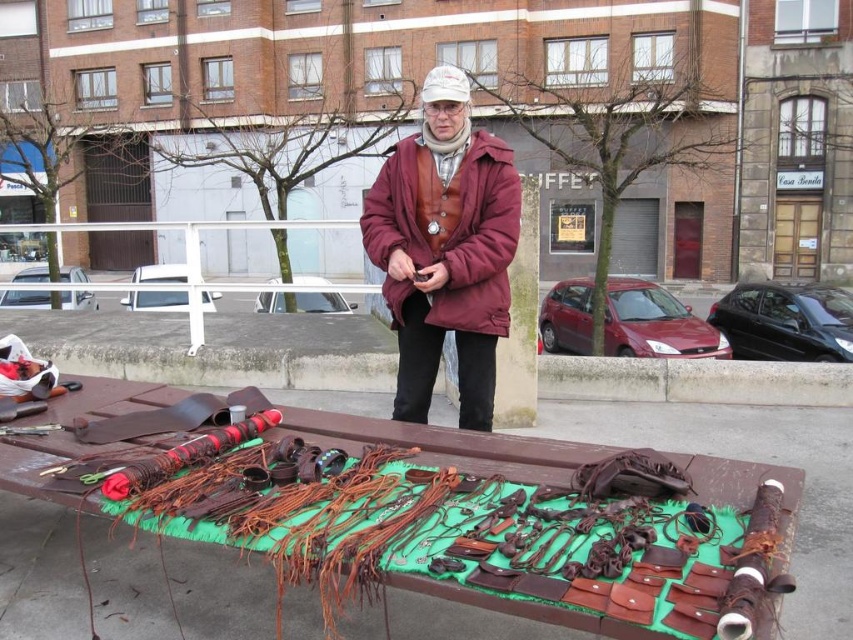
Question: Can you confirm if brown leather table at center is thinner than leather vest at center?

Choices:
 (A) no
 (B) yes

Answer: (A)

Question: Does brown leather table at center appear on the right side of leather vest at center?

Choices:
 (A) yes
 (B) no

Answer: (B)

Question: Where is brown leather table at center located in relation to leather vest at center in the image?

Choices:
 (A) left
 (B) right

Answer: (A)

Question: Which point appears farthest from the camera in this image?

Choices:
 (A) click(x=461, y=588)
 (B) click(x=440, y=164)

Answer: (B)